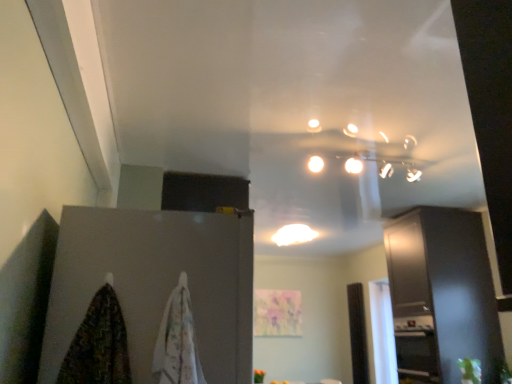
Question: Is white cotton towel at lower left, which appears as the 1th blanket when viewed from the right, thinner than white glossy light fixture at center?

Choices:
 (A) yes
 (B) no

Answer: (A)

Question: Is white cotton towel at lower left, arranged as the second blanket when viewed from the left, oriented towards white glossy light fixture at center?

Choices:
 (A) no
 (B) yes

Answer: (A)

Question: Can you confirm if white cotton towel at lower left, which appears as the 1th blanket when viewed from the right, is wider than white glossy light fixture at center?

Choices:
 (A) yes
 (B) no

Answer: (B)

Question: From a real-world perspective, is white cotton towel at lower left, arranged as the second blanket when viewed from the left, beneath white glossy light fixture at center?

Choices:
 (A) yes
 (B) no

Answer: (A)

Question: Is white cotton towel at lower left, arranged as the second blanket when viewed from the left, positioned far away from white glossy light fixture at center?

Choices:
 (A) no
 (B) yes

Answer: (B)

Question: Does white cotton towel at lower left, arranged as the second blanket when viewed from the left, have a lesser height compared to white glossy light fixture at center?

Choices:
 (A) no
 (B) yes

Answer: (A)

Question: Is white cotton towel at lower left, arranged as the second blanket when viewed from the left, directly adjacent to matte gray cabinet at left, the second cabinetry positioned from the back?

Choices:
 (A) yes
 (B) no

Answer: (B)

Question: Is white cotton towel at lower left, which appears as the 1th blanket when viewed from the right, to the left of matte gray cabinet at left, the 1th cabinetry in the left-to-right sequence, from the viewer's perspective?

Choices:
 (A) yes
 (B) no

Answer: (B)

Question: Does white cotton towel at lower left, arranged as the second blanket when viewed from the left, have a smaller size compared to matte gray cabinet at left, the 1th cabinetry in the left-to-right sequence?

Choices:
 (A) yes
 (B) no

Answer: (A)

Question: From a real-world perspective, is white cotton towel at lower left, which appears as the 1th blanket when viewed from the right, below matte gray cabinet at left, the second cabinetry positioned from the back?

Choices:
 (A) no
 (B) yes

Answer: (B)

Question: Does white cotton towel at lower left, arranged as the second blanket when viewed from the left, have a greater height compared to matte gray cabinet at left, the second cabinetry positioned from the back?

Choices:
 (A) yes
 (B) no

Answer: (B)

Question: Can you confirm if white cotton towel at lower left, which appears as the 1th blanket when viewed from the right, is thinner than matte gray cabinet at left, the 1th cabinetry in the left-to-right sequence?

Choices:
 (A) no
 (B) yes

Answer: (B)

Question: From a real-world perspective, is multicolored fabric at lower left, which is the second blanket in right-to-left order, on white cotton towel at lower left, which appears as the 1th blanket when viewed from the right?

Choices:
 (A) no
 (B) yes

Answer: (A)